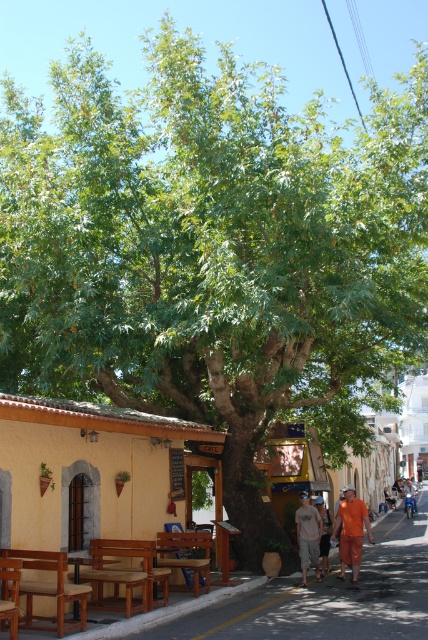
Question: Which object is closer to the camera taking this photo?

Choices:
 (A) orange cotton shorts at center
 (B) brown wooden picnic table at center
 (C) orange cotton shirt at center
 (D) smooth concrete pavement at lower center

Answer: (D)

Question: Can you confirm if brown wooden picnic table at center is wider than orange cotton shirt at center?

Choices:
 (A) no
 (B) yes

Answer: (A)

Question: Which object is positioned farthest from the smooth concrete pavement at lower center?

Choices:
 (A) light brown cotton shorts at lower center
 (B) brown wooden picnic table at center
 (C) orange cotton shirt at center
 (D) orange cotton shorts at center

Answer: (C)

Question: Which point is farther from the camera taking this photo?

Choices:
 (A) (327, 570)
 (B) (353, 545)
 (C) (296, 515)

Answer: (A)

Question: Is smooth concrete pavement at lower center positioned before brown wooden picnic table at center?

Choices:
 (A) yes
 (B) no

Answer: (A)

Question: Can you confirm if brown wooden picnic table at center is positioned below orange cotton shirt at center?

Choices:
 (A) yes
 (B) no

Answer: (B)